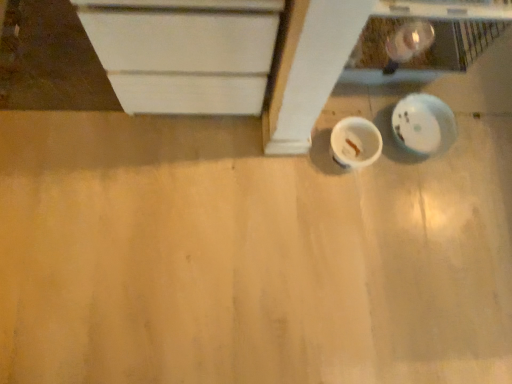
Where is `vacant space that is to the left of white glossy plate at lower right`? The width and height of the screenshot is (512, 384). vacant space that is to the left of white glossy plate at lower right is located at coordinates (365, 99).